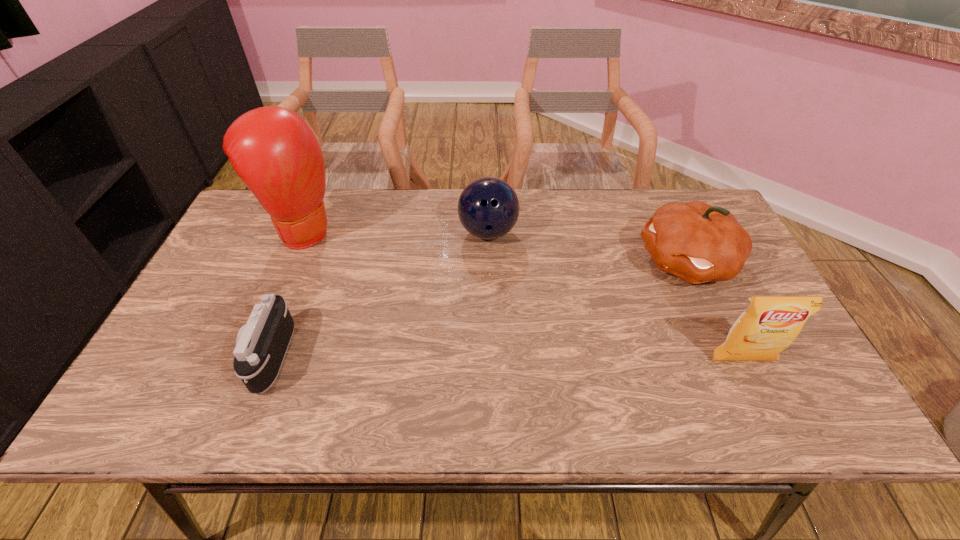
Where is `bowling ball located in the far edge section of the desktop`? This screenshot has width=960, height=540. bowling ball located in the far edge section of the desktop is located at coordinates (488, 208).

Image resolution: width=960 pixels, height=540 pixels. I want to click on camera located at the near edge, so click(261, 345).

At what (x,y) coordinates should I click in order to perform the action: click on crisp (potato chip) that is at the near edge. Please return your answer as a coordinate pair (x, y). This screenshot has width=960, height=540. Looking at the image, I should click on 769,325.

Locate an element on the screen. object located at the left edge is located at coordinates (272, 149).

This screenshot has width=960, height=540. In order to click on crisp (potato chip) that is at the right edge in this screenshot , I will do `click(769, 325)`.

I want to click on pumpkin that is at the right edge, so click(698, 243).

Locate an element on the screen. This screenshot has height=540, width=960. object present at the far left corner is located at coordinates (272, 149).

Identify the location of object that is positioned at the far right corner. This screenshot has width=960, height=540. (698, 243).

At what (x,y) coordinates should I click in order to perform the action: click on object located at the near right corner. Please return your answer as a coordinate pair (x, y). Looking at the image, I should click on (769, 325).

Where is `free space at the far edge of the desktop`? free space at the far edge of the desktop is located at coordinates (585, 235).